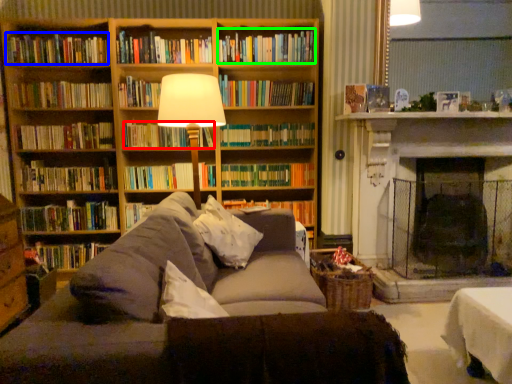
Question: Considering the real-world distances, which object is farthest from book (highlighted by a red box)? book (highlighted by a blue box) or book (highlighted by a green box)?

Choices:
 (A) book
 (B) book

Answer: (B)